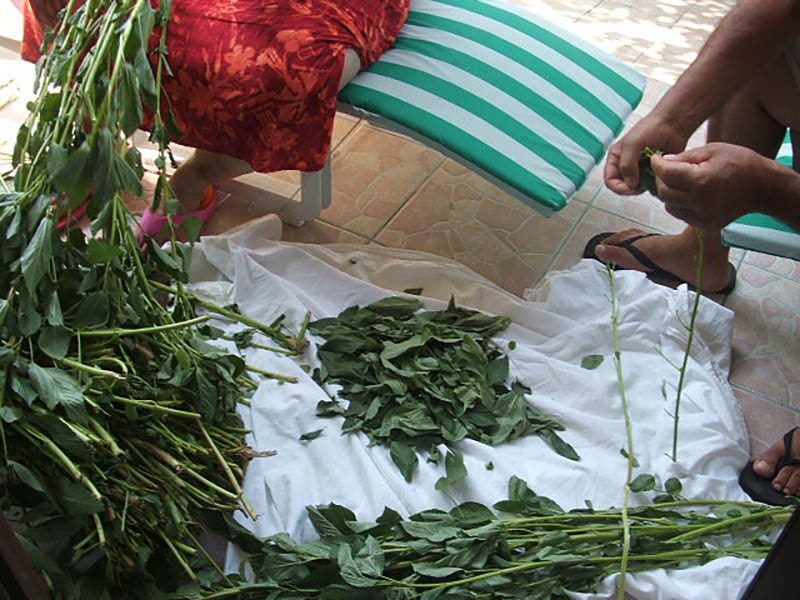
Identify the location of chair seat cushion. (409, 42).